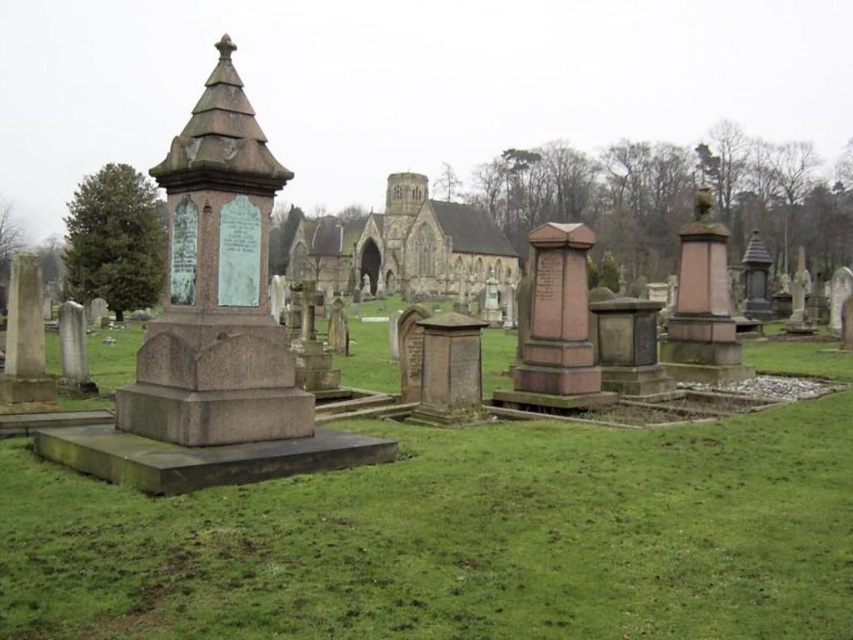
Question: In this image, where is green grass at center located relative to brown stone church at center?

Choices:
 (A) below
 (B) above

Answer: (A)

Question: Can you confirm if green grass at center is positioned above brown stone church at center?

Choices:
 (A) yes
 (B) no

Answer: (B)

Question: Which object is farther from the camera taking this photo?

Choices:
 (A) green grass at center
 (B) brown stone church at center

Answer: (B)

Question: Among these points, which one is nearest to the camera?

Choices:
 (A) tap(314, 244)
 (B) tap(740, 458)

Answer: (B)

Question: Can you confirm if green grass at center is positioned to the left of brown stone church at center?

Choices:
 (A) no
 (B) yes

Answer: (A)